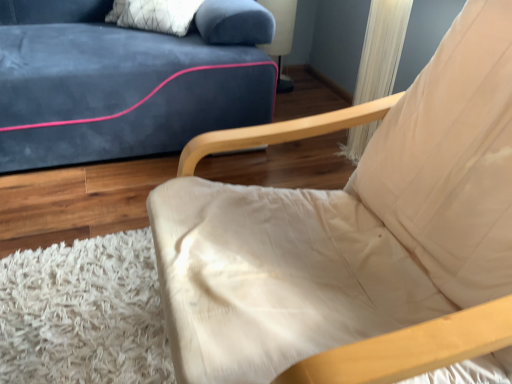
Find the location of a particular element. vacant space to the right of matte plastic table lamp at upper center is located at coordinates pos(311,82).